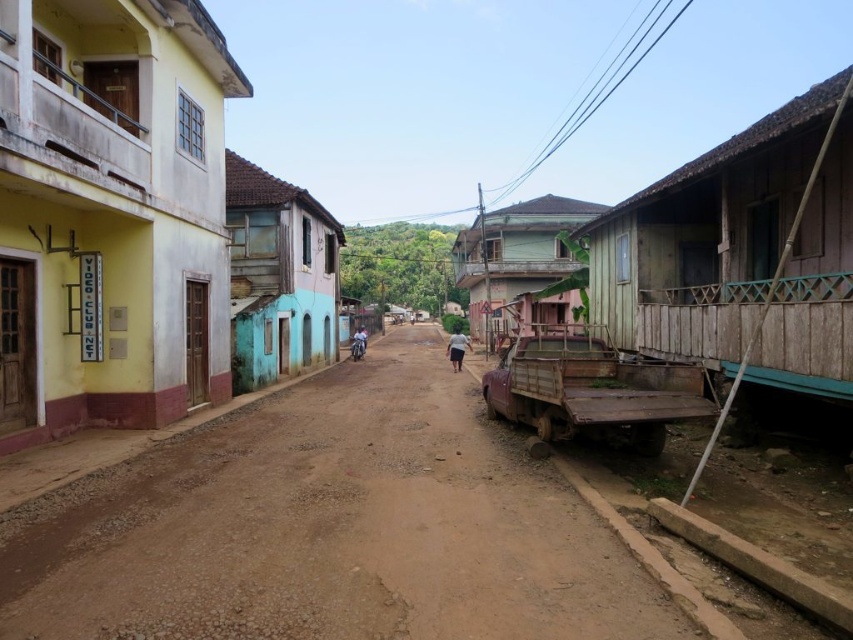
Is point (309, 278) farther from viewer compared to point (358, 336)?

No, (309, 278) is in front of (358, 336).

The height and width of the screenshot is (640, 853). In order to click on blue painted wood hut at center in this screenshot , I will do pos(277,276).

Does blue painted wood hut at center have a greater width compared to white matte shirt at center?

Indeed, blue painted wood hut at center has a greater width compared to white matte shirt at center.

What do you see at coordinates (277, 276) in the screenshot? I see `blue painted wood hut at center` at bounding box center [277, 276].

Find the location of a particular element. The height and width of the screenshot is (640, 853). blue painted wood hut at center is located at coordinates (277, 276).

This screenshot has width=853, height=640. What do you see at coordinates (515, 252) in the screenshot?
I see `rustic wooden hut at center` at bounding box center [515, 252].

Based on the photo, between rustic wooden hut at center and white matte shirt at center, which one appears on the left side from the viewer's perspective?

white matte shirt at center

Between point (492, 236) and point (457, 349), which one is positioned behind?

The point (492, 236) is more distant.

Identify the location of rustic wooden hut at center. (515, 252).